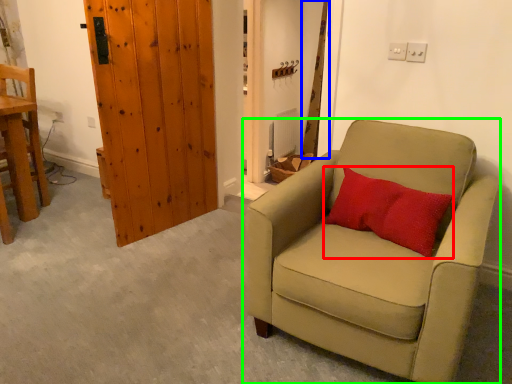
Question: Which object is the farthest from pillow (highlighted by a red box)? Choose among these: curtain (highlighted by a blue box) or chair (highlighted by a green box).

Choices:
 (A) curtain
 (B) chair

Answer: (A)